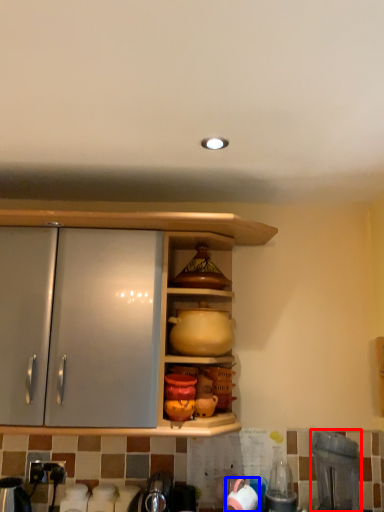
Question: Which of the following is the farthest to the observer, appliance (highlighted by a red box) or tableware (highlighted by a blue box)?

Choices:
 (A) appliance
 (B) tableware

Answer: (B)